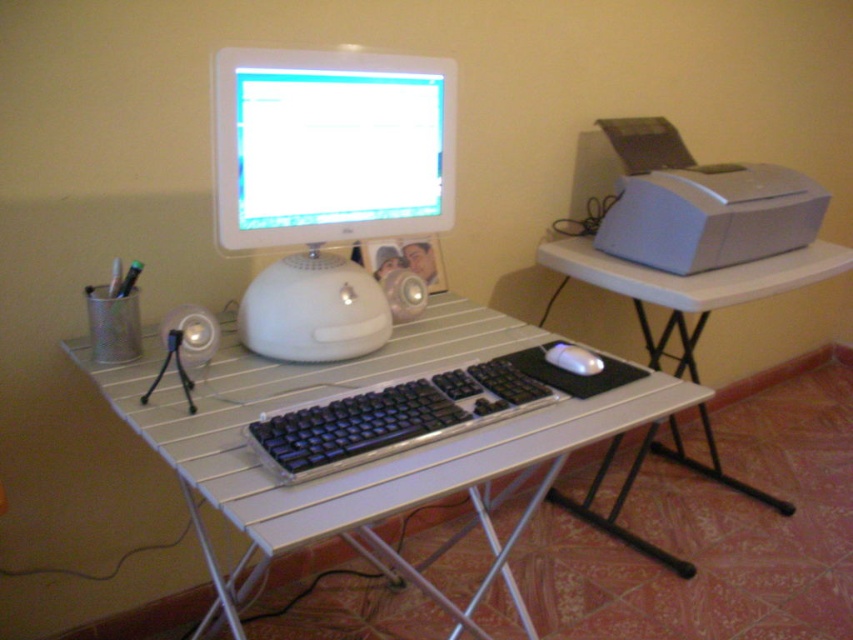
Can you confirm if metallic silver computer desk at center is bigger than satin silver printer at right?

Indeed, metallic silver computer desk at center has a larger size compared to satin silver printer at right.

Is metallic silver computer desk at center further to the viewer compared to satin silver printer at right?

No, it is in front of satin silver printer at right.

Where is `metallic silver computer desk at center`? The image size is (853, 640). metallic silver computer desk at center is located at coordinates pyautogui.click(x=378, y=436).

Who is more distant from viewer, (619, 529) or (592, 360)?

The point (619, 529) is behind.

In the scene shown: Is white plastic table at right bigger than satin silver mouse at center?

Indeed, white plastic table at right has a larger size compared to satin silver mouse at center.

The width and height of the screenshot is (853, 640). What do you see at coordinates (686, 288) in the screenshot? I see `white plastic table at right` at bounding box center [686, 288].

This screenshot has height=640, width=853. I want to click on white plastic table at right, so click(686, 288).

Is metallic silver computer desk at center shorter than satin silver mouse at center?

No.

Between metallic silver computer desk at center and satin silver mouse at center, which one appears on the left side from the viewer's perspective?

Positioned to the left is metallic silver computer desk at center.

Is point (503, 419) less distant than point (579, 360)?

That is True.

Find the location of a particular element. metallic silver computer desk at center is located at coordinates (378, 436).